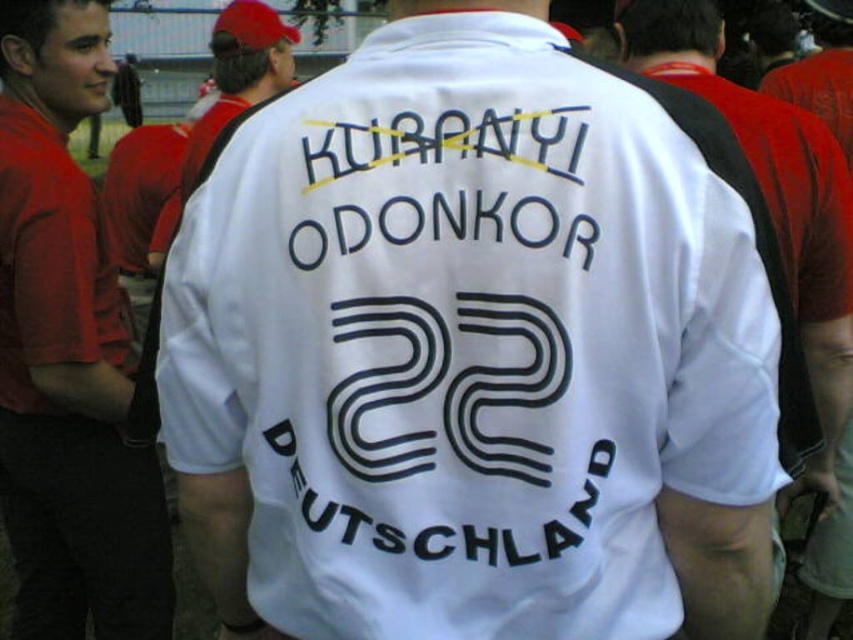
You are at a soccer match and see a player wearing a white sports jersey with black text and numbers. The jersey has the name KURANYI ODONKOR and the number 22. You notice a point marked at coordinates (442, 180). Based on the description, what does this point likely indicate on the jersey?

The point at coordinates (442, 180) likely indicates the black text at center on the jersey.

You are standing in the crowd at a soccer match and want to take a photo of the point at coordinates (16, 252). If your camera can focus on objects within 2 meters, will it be able to capture that point clearly?

The distance of point (16, 252) from the viewer is 1.98 meters, so yes, the camera can focus on it clearly since it is within the 2 meters range.

You are at a soccer match and see a person wearing a white sports jersey with the name KURANYI ODONKOR and the number 22. To your left, there is a matte red shirt at left and a black text at center on the jersey. Which item is closer to your left side?

The matte red shirt at left is positioned on the left side of black text at center, so the matte red shirt at left is closer to your left side.